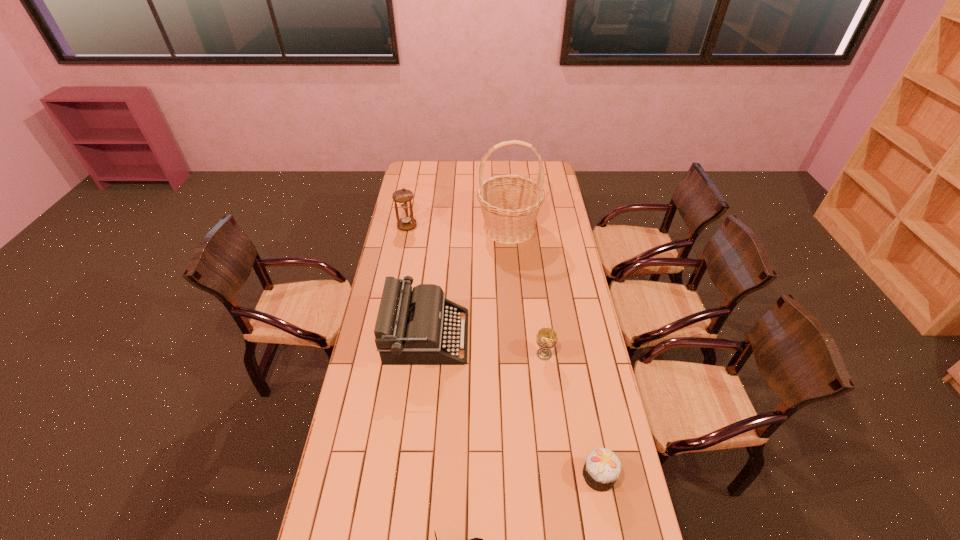
This screenshot has height=540, width=960. What are the coordinates of `the tallest object` in the screenshot? It's located at (510, 204).

Where is `hourglass`? The image size is (960, 540). hourglass is located at coordinates (403, 196).

Where is `typewriter`? The height and width of the screenshot is (540, 960). typewriter is located at coordinates (414, 327).

Locate an element on the screen. This screenshot has width=960, height=540. chalice is located at coordinates (546, 338).

You are a GUI agent. You are given a task and a screenshot of the screen. Output one action in this format:
    pyautogui.click(x=<x>, y=<y>)
    Task: Click on the second nearest object
    The width and height of the screenshot is (960, 540).
    Given the screenshot: What is the action you would take?
    pyautogui.click(x=602, y=467)

Locate an element on the screen. The image size is (960, 540). cupcake is located at coordinates (602, 467).

I want to click on vacant space located on the right of the basket, so click(x=562, y=228).

At what (x,y) coordinates should I click in order to perform the action: click on vacant space located 0.210m on the back of the hourglass. Please return your answer as a coordinate pair (x, y). Looking at the image, I should click on (413, 198).

I want to click on free point located 0.370m on the typing side of the typewriter, so [558, 336].

Where is `free space located 0.100m on the right of the chalice`? free space located 0.100m on the right of the chalice is located at coordinates (580, 354).